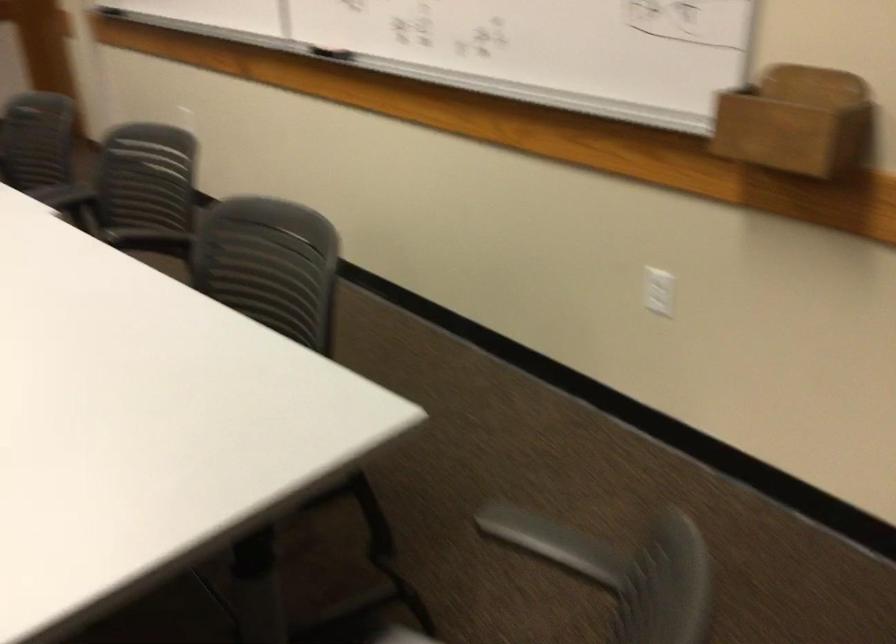
Find where to placing in the wooden wall holder. Please return your answer as a coordinate pair (x, y).

(797, 122)